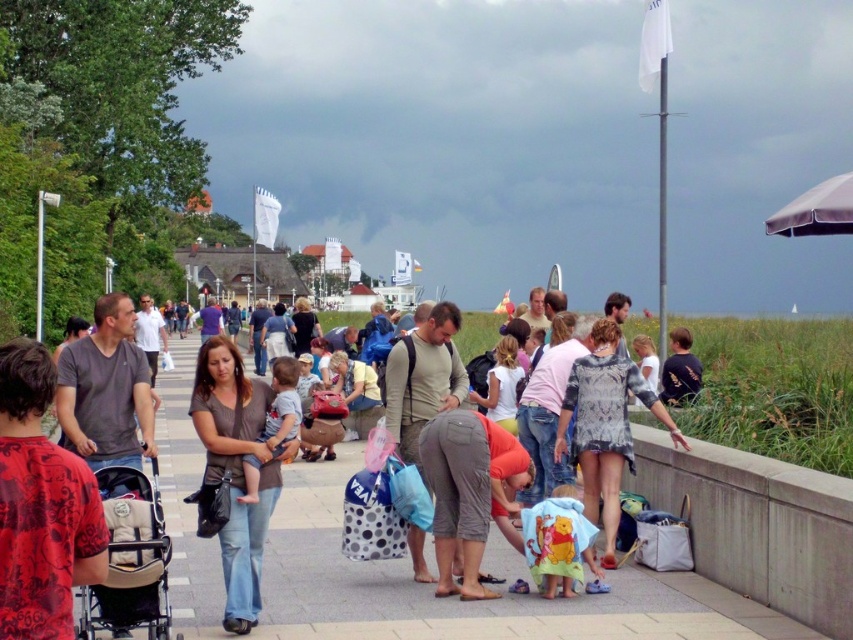
Question: Estimate the real-world distances between objects in this image. Which object is farther from the beige fabric baby carriage at lower left?

Choices:
 (A) matte brown shirt at center
 (B) red printed shirt at center

Answer: (A)

Question: Estimate the real-world distances between objects in this image. Which object is closer to the beige fabric baby carriage at lower left?

Choices:
 (A) red printed shirt at center
 (B) matte brown shirt at center

Answer: (A)

Question: Does red printed shirt at center appear under matte brown shirt at center?

Choices:
 (A) no
 (B) yes

Answer: (A)

Question: Does red printed shirt at center have a greater width compared to matte brown shirt at center?

Choices:
 (A) no
 (B) yes

Answer: (A)

Question: Does red printed shirt at center appear on the left side of beige fabric baby carriage at lower left?

Choices:
 (A) yes
 (B) no

Answer: (A)

Question: Which object is farther from the camera taking this photo?

Choices:
 (A) matte brown shirt at center
 (B) red printed shirt at center

Answer: (A)